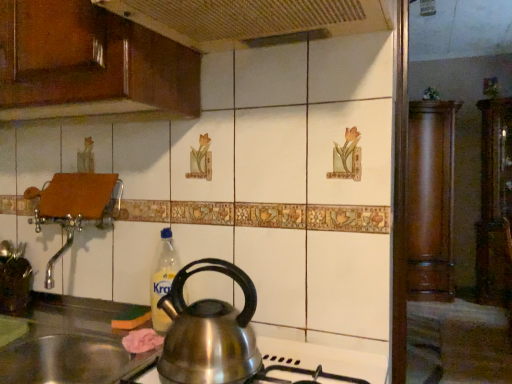
Question: Is stainless steel sink at lower left a part of mahogany wood cabinet at right, the 3th cabinetry positioned from the front?

Choices:
 (A) yes
 (B) no

Answer: (B)

Question: Is mahogany wood cabinet at right, the second cabinetry in the right-to-left sequence, at the left side of stainless steel sink at lower left?

Choices:
 (A) no
 (B) yes

Answer: (A)

Question: Considering the relative sizes of mahogany wood cabinet at right, the 3th cabinetry positioned from the front, and stainless steel sink at lower left in the image provided, is mahogany wood cabinet at right, the 3th cabinetry positioned from the front, taller than stainless steel sink at lower left?

Choices:
 (A) yes
 (B) no

Answer: (A)

Question: From the image's perspective, is mahogany wood cabinet at right, the second cabinetry in the right-to-left sequence, beneath stainless steel sink at lower left?

Choices:
 (A) no
 (B) yes

Answer: (A)

Question: Considering the relative sizes of mahogany wood cabinet at right, the 3th cabinetry positioned from the front, and stainless steel sink at lower left in the image provided, is mahogany wood cabinet at right, the 3th cabinetry positioned from the front, bigger than stainless steel sink at lower left?

Choices:
 (A) yes
 (B) no

Answer: (A)

Question: Which is correct: stainless steel sink at lower left is inside wooden panel at upper left, or outside of it?

Choices:
 (A) outside
 (B) inside

Answer: (A)

Question: In the image, is stainless steel sink at lower left positioned in front of or behind wooden panel at upper left?

Choices:
 (A) behind
 (B) front

Answer: (A)

Question: From the image's perspective, relative to wooden panel at upper left, is stainless steel sink at lower left above or below?

Choices:
 (A) above
 (B) below

Answer: (B)

Question: In terms of height, does stainless steel sink at lower left look taller or shorter compared to wooden panel at upper left?

Choices:
 (A) short
 (B) tall

Answer: (B)

Question: From a real-world perspective, is wooden cabinet at right, the 3th cabinetry positioned from the left, above or below mahogany wood cabinet at right, which ranks as the 2th cabinetry in left-to-right order?

Choices:
 (A) below
 (B) above

Answer: (B)

Question: Based on their sizes in the image, would you say wooden cabinet at right, the first cabinetry positioned from the right, is bigger or smaller than mahogany wood cabinet at right, the 3th cabinetry positioned from the front?

Choices:
 (A) big
 (B) small

Answer: (A)

Question: From the image's perspective, is wooden cabinet at right, the first cabinetry positioned from the right, positioned above or below mahogany wood cabinet at right, which ranks as the 2th cabinetry in left-to-right order?

Choices:
 (A) below
 (B) above

Answer: (B)

Question: Is wooden cabinet at right, the 2th cabinetry in the front-to-back sequence, taller or shorter than mahogany wood cabinet at right, the 3th cabinetry positioned from the front?

Choices:
 (A) tall
 (B) short

Answer: (A)

Question: In terms of size, does wooden cabinet at right, positioned as the second cabinetry in back-to-front order, appear bigger or smaller than stainless steel sink at lower left?

Choices:
 (A) small
 (B) big

Answer: (B)

Question: Based on their positions, is wooden cabinet at right, the 2th cabinetry in the front-to-back sequence, located to the left or right of stainless steel sink at lower left?

Choices:
 (A) left
 (B) right

Answer: (B)